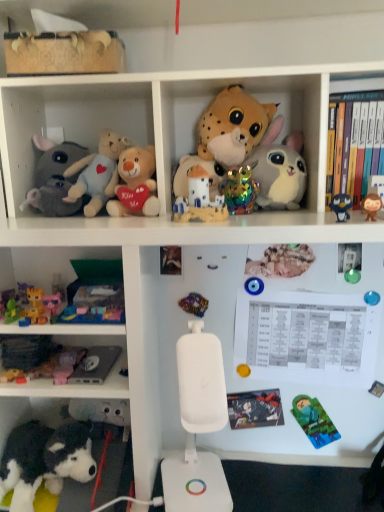
Question: Is point (198, 196) closer or farther from the camera than point (304, 163)?

Choices:
 (A) farther
 (B) closer

Answer: (B)

Question: Choose the correct answer: Is matte ceramic castle at center, which is counted as the eighth toy, starting from the left, inside white plush rabbit at upper center, arranged as the 11th toy when viewed from the left, or outside it?

Choices:
 (A) inside
 (B) outside

Answer: (B)

Question: Estimate the real-world distances between objects in this image. Which object is farther from the matt black comic book at center, placed as the 1th book when sorted from left to right?

Choices:
 (A) black plush dog at lower left, which is counted as the fourth toy, starting from the left
 (B) fluffy plush toys at left
 (C) spotted fur plush at center, positioned as the ninth toy in left-to-right order
 (D) yellow plush toy at lower left, the 1th toy positioned from the left
 (E) green plastic ball at upper right, the 13th toy viewed from the left

Answer: (B)

Question: Which object is the closest to the fluffy plush toys at left?

Choices:
 (A) spotted fur plush at center, positioned as the ninth toy in left-to-right order
 (B) multicolored beads at center, which ranks as the eighth toy in right-to-left order
 (C) matte ceramic castle at center, which is counted as the eighth toy, starting from the left
 (D) velvety plush bear at center left, the sixth toy positioned from the left
 (E) gray plush elephant at left, the 3th toy positioned from the left

Answer: (E)